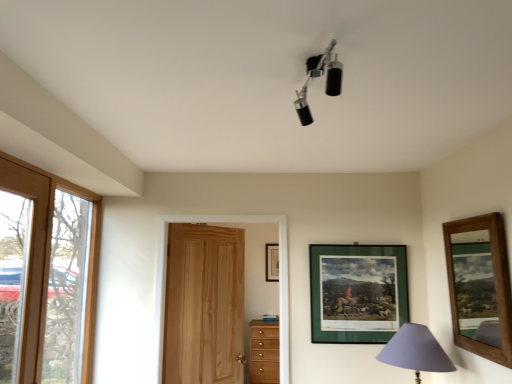
Question: Considering the positions of wooden framed mirror at right, the 1th picture frame in the right-to-left sequence, and clear glass window at left in the image, is wooden framed mirror at right, the 1th picture frame in the right-to-left sequence, taller or shorter than clear glass window at left?

Choices:
 (A) short
 (B) tall

Answer: (A)

Question: Does point (464, 296) appear closer or farther from the camera than point (42, 223)?

Choices:
 (A) closer
 (B) farther

Answer: (B)

Question: Which is farther from the green matte picture frame at upper center, the second picture frame in the back-to-front sequence?

Choices:
 (A) light brown wooden chest of drawers at lower center
 (B) natural wood door at center
 (C) black matte spotlights at upper center, which appears as the 1th lamp when viewed from the front
 (D) wooden picture frame at upper center, placed as the first picture frame when sorted from left to right
 (E) purple fabric lampshade at lower right, the 2th lamp in the top-to-bottom sequence

Answer: (C)

Question: Considering the real-world distances, which object is closest to the clear glass window at left?

Choices:
 (A) green matte picture frame at upper center, placed as the second picture frame when sorted from front to back
 (B) natural wood door at center
 (C) wooden picture frame at upper center, placed as the first picture frame when sorted from back to front
 (D) purple fabric lampshade at lower right, acting as the 2th lamp starting from the front
 (E) wooden framed mirror at right, the 1th picture frame in the right-to-left sequence

Answer: (B)